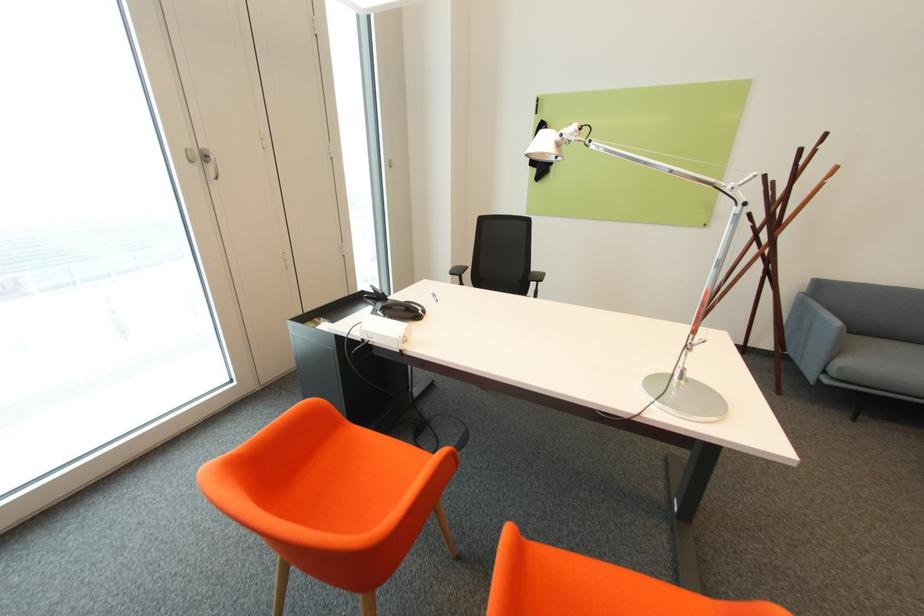
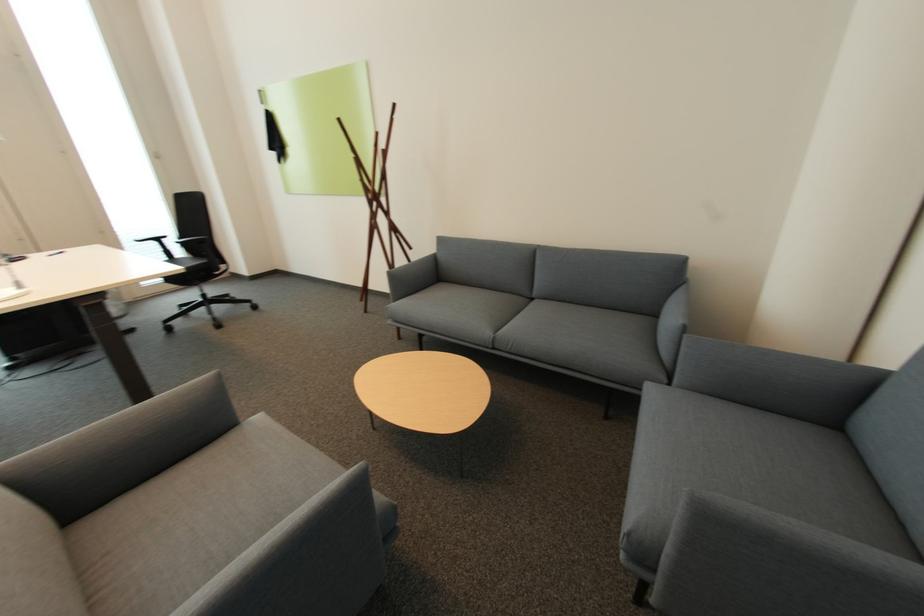
Question: The images are taken continuously from a first-person perspective. In which direction are you moving?

Choices:
 (A) Left
 (B) Right
 (C) Forward
 (D) Backward

Answer: (B)